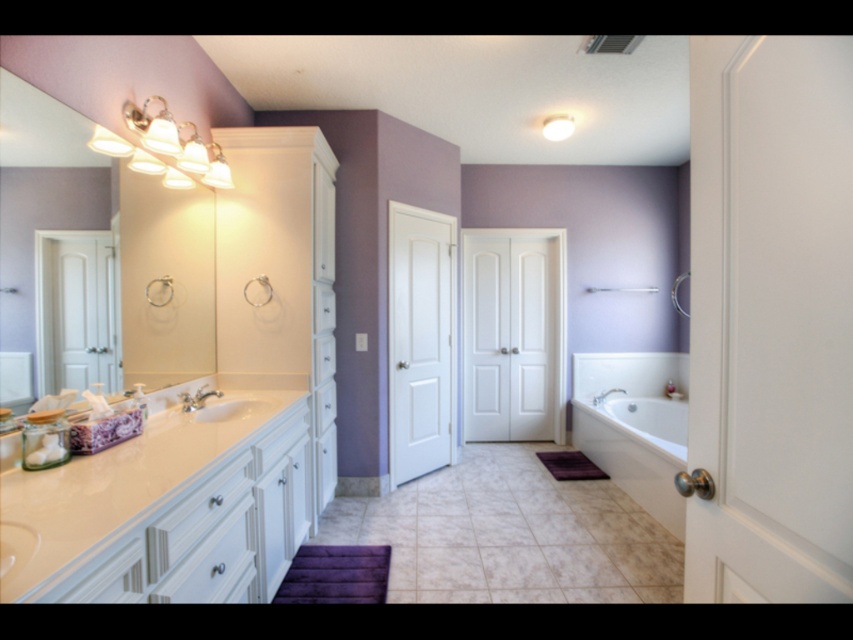
You are a plumber trying to fix the water supply line for the silver metallic faucet at lower right. You need to access the pipe behind the white glossy sink at center. Is the sink blocking the access to the faucet?

Answer: The white glossy sink at center is in front of the silver metallic faucet at lower right, so the sink is blocking access to the faucet. You will need to move or remove the sink to access the pipe behind it.

You are a plumber trying to fix the silver metallic faucet at lower right. You need to access it but there is a white glossy bathtub at right in the way. Can you move the bathtub to reach the faucet?

The white glossy bathtub at right is in front of the silver metallic faucet at lower right, so you cannot access the faucet without moving the bathtub first.

You are standing in the bathroom and want to wash your hands. Which object should you approach first, the white glossy sink at center or the white glossy shower at center?

You should approach the white glossy sink at center first because it is in front of the white glossy shower at center, making it closer to you.